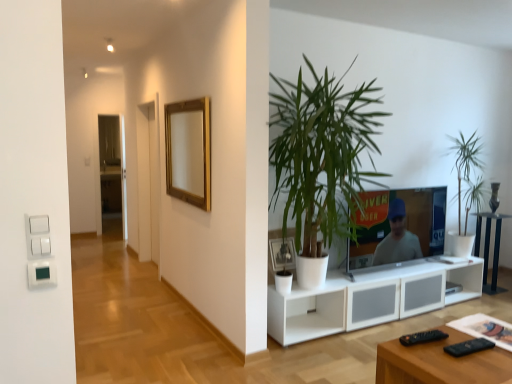
Question: Is transparent glass door at center inside or outside of gold wooden picture frame at upper center, which is the second picture frame in front-to-back order?

Choices:
 (A) inside
 (B) outside

Answer: (B)

Question: Considering the positions of transparent glass door at center and gold wooden picture frame at upper center, which appears as the second picture frame when viewed from the right, in the image, is transparent glass door at center taller or shorter than gold wooden picture frame at upper center, which appears as the second picture frame when viewed from the right,?

Choices:
 (A) tall
 (B) short

Answer: (A)

Question: Estimate the real-world distances between objects in this image. Which object is farther from the black plastic remote at lower right, which appears as the first remote when viewed from the left?

Choices:
 (A) transparent glass door at center
 (B) white matte picture frame at center, which is counted as the second picture frame, starting from the back
 (C) green leafy plant at center, which appears as the 2th houseplant when viewed from the right
 (D) green leafy plant at right, the 2th houseplant positioned from the front
 (E) black glass side table at lower right

Answer: (A)

Question: Which of these objects is positioned closest to the black plastic remote at lower right, which is the first remote in right-to-left order?

Choices:
 (A) white matte picture frame at center, which is the 1th picture frame in bottom-to-top order
 (B) white ceramic vase at center
 (C) black glass side table at lower right
 (D) green leafy plant at center, the first houseplant viewed from the front
 (E) transparent glass door at center

Answer: (A)